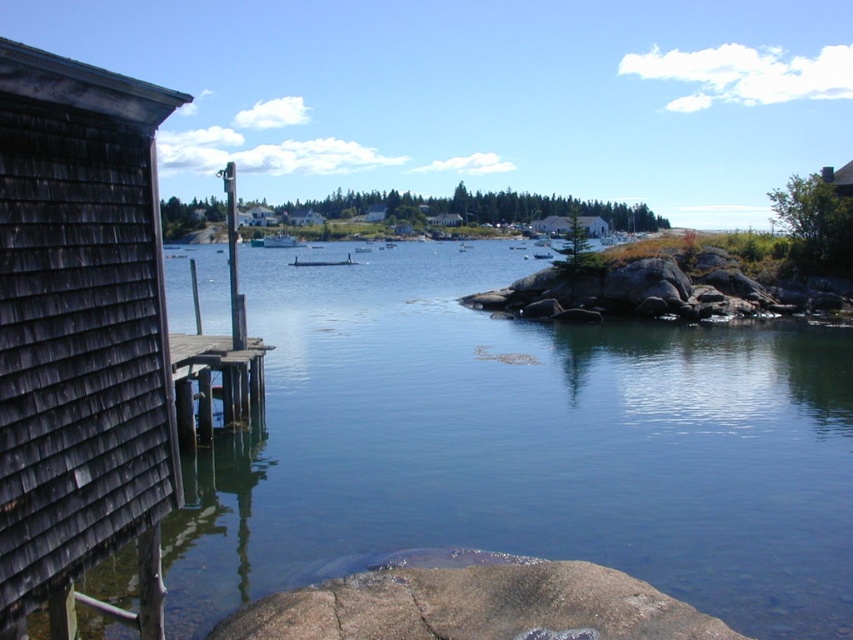
You are a tourist standing on the wooden pier and want to visit both the wooden shingles hut at left and the white shingled hut at center. Which one should you go to first if you want to visit the one closer to the pier first?

You should visit the wooden shingles hut at left first because it is positioned to the left of the white shingled hut at center, making it closer to the pier.

You are standing on the wooden pier and want to walk to the white shingled house at center and the white matte boat at center. Which one is closer to you?

The white matte boat at center is closer to you because it is at the center, while the white shingled house at center is further away. However, according to the description, both are at center but 37.22 meters apart. Wait, this is conflicting. Let me recalculate. The description says they are 37.22 meters apart. Since you are on the pier, which extends into the water, and both objects are at center, perhaps the boat is on the water near the pier, while the house is on land further back. Therefore, the boat,

You are a photographer planning to capture the green matte boat at center and the white shingled hut at center from a low angle. Which object will appear taller in your photo?

The green matte boat at center will appear taller in the photo since it has a greater height compared to the white shingled hut at center.